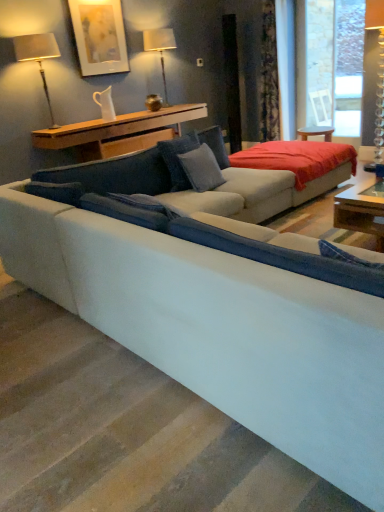
In order to face blue fabric pillow at center, positioned as the first pillow in right-to-left order, should I rotate leftwards or rightwards?

A 1.529 degree turn to the right will do.

What do you see at coordinates (99, 36) in the screenshot? I see `matte white picture frame at upper left` at bounding box center [99, 36].

Image resolution: width=384 pixels, height=512 pixels. In order to click on wooden shelf at upper center in this screenshot , I will do `click(119, 132)`.

What do you see at coordinates (178, 159) in the screenshot? I see `suede-like blue pillow at center, which is the second pillow in right-to-left order` at bounding box center [178, 159].

Locate an element on the screen. matte silver table lamp at upper left, which ranks as the 1th table lamp in left-to-right order is located at coordinates (38, 57).

How much space does matte silver table lamp at upper left, which ranks as the 1th table lamp in left-to-right order, occupy horizontally?

matte silver table lamp at upper left, which ranks as the 1th table lamp in left-to-right order, is 9.94 inches wide.

The height and width of the screenshot is (512, 384). Find the location of `blue fabric pillow at center, positioned as the first pillow in right-to-left order`. blue fabric pillow at center, positioned as the first pillow in right-to-left order is located at coordinates (201, 168).

Visually, is blue fabric pillow at center, placed as the 2th pillow when sorted from left to right, positioned to the left or to the right of matte white lampshade at upper center, which is counted as the first table lamp, starting from the back?

In the image, blue fabric pillow at center, placed as the 2th pillow when sorted from left to right, appears on the right side of matte white lampshade at upper center, which is counted as the first table lamp, starting from the back.

Is blue fabric pillow at center, placed as the 2th pillow when sorted from left to right, located outside matte white lampshade at upper center, positioned as the 1th table lamp in right-to-left order?

Yes.

Consider the image. Can you tell me how much blue fabric pillow at center, positioned as the first pillow in right-to-left order, and matte white lampshade at upper center, positioned as the 1th table lamp in right-to-left order, differ in facing direction?

blue fabric pillow at center, positioned as the first pillow in right-to-left order, and matte white lampshade at upper center, positioned as the 1th table lamp in right-to-left order, are facing 9.56 degrees away from each other.

From the image's perspective, is blue fabric pillow at center, positioned as the first pillow in right-to-left order, positioned above or below matte white picture frame at upper left?

From the image's perspective, blue fabric pillow at center, positioned as the first pillow in right-to-left order, appears below matte white picture frame at upper left.

Is blue fabric pillow at center, positioned as the first pillow in right-to-left order, far away from matte white picture frame at upper left?

Indeed, blue fabric pillow at center, positioned as the first pillow in right-to-left order, is not near matte white picture frame at upper left.

Is matte white picture frame at upper left a part of blue fabric pillow at center, positioned as the first pillow in right-to-left order?

Actually, matte white picture frame at upper left is outside blue fabric pillow at center, positioned as the first pillow in right-to-left order.

Is blue fabric pillow at center, placed as the 2th pillow when sorted from left to right, looking in the opposite direction of matte white picture frame at upper left?

blue fabric pillow at center, placed as the 2th pillow when sorted from left to right, is not turned away from matte white picture frame at upper left.

Between suede-like blue pillow at center, which is the second pillow in right-to-left order, and matte white lampshade at upper center, the second table lamp viewed from the left, which one has less height?

With less height is suede-like blue pillow at center, which is the second pillow in right-to-left order.

Does suede-like blue pillow at center, which is the second pillow in right-to-left order, turn towards matte white lampshade at upper center, the second table lamp viewed from the left?

No, suede-like blue pillow at center, which is the second pillow in right-to-left order, is not facing towards matte white lampshade at upper center, the second table lamp viewed from the left.

Identify the location of the 1st table lamp to the left of the suede-like blue pillow at center, which is the second pillow in right-to-left order, counting from the anchor's position. The height and width of the screenshot is (512, 384). click(x=160, y=49).

From the picture: In the image, is suede-like blue pillow at center, which is the second pillow in right-to-left order, positioned in front of or behind matte white lampshade at upper center, which is counted as the first table lamp, starting from the back?

suede-like blue pillow at center, which is the second pillow in right-to-left order, is in front of matte white lampshade at upper center, which is counted as the first table lamp, starting from the back.

Considering the relative sizes of blue fabric pillow at center, positioned as the first pillow in right-to-left order, and wooden shelf at upper center in the image provided, is blue fabric pillow at center, positioned as the first pillow in right-to-left order, smaller than wooden shelf at upper center?

Yes, blue fabric pillow at center, positioned as the first pillow in right-to-left order, is smaller than wooden shelf at upper center.

Looking at this image, is blue fabric pillow at center, placed as the 2th pillow when sorted from left to right, looking in the opposite direction of wooden shelf at upper center?

Correct, blue fabric pillow at center, placed as the 2th pillow when sorted from left to right, is looking away from wooden shelf at upper center.

Is blue fabric pillow at center, positioned as the first pillow in right-to-left order, outside of wooden shelf at upper center?

Yes, blue fabric pillow at center, positioned as the first pillow in right-to-left order, is outside of wooden shelf at upper center.

In the scene shown: Can you confirm if blue fabric pillow at center, placed as the 2th pillow when sorted from left to right, is wider than wooden shelf at upper center?

Incorrect, the width of blue fabric pillow at center, placed as the 2th pillow when sorted from left to right, does not surpass that of wooden shelf at upper center.

Does matte white picture frame at upper left have a lesser height compared to suede-like blue pillow at center, which is the second pillow in right-to-left order?

No, matte white picture frame at upper left is not shorter than suede-like blue pillow at center, which is the second pillow in right-to-left order.

Is matte white picture frame at upper left oriented towards suede-like blue pillow at center, which is the second pillow in right-to-left order?

No, matte white picture frame at upper left is not facing towards suede-like blue pillow at center, which is the second pillow in right-to-left order.

Is matte white picture frame at upper left closer to camera compared to suede-like blue pillow at center, which is the second pillow in right-to-left order?

No, it is behind suede-like blue pillow at center, which is the second pillow in right-to-left order.

From a real-world perspective, is matte white picture frame at upper left below suede-like blue pillow at center, which is the second pillow in right-to-left order?

No, from a real-world perspective, matte white picture frame at upper left is not below suede-like blue pillow at center, which is the second pillow in right-to-left order.

From the image's perspective, is wooden shelf at upper center on top of matte white picture frame at upper left?

No, from the image's perspective, wooden shelf at upper center is not on top of matte white picture frame at upper left.

Considering the points (122, 123) and (123, 32), which point is behind, point (122, 123) or point (123, 32)?

The point (123, 32) is more distant.

Measure the distance from wooden shelf at upper center to matte white picture frame at upper left.

wooden shelf at upper center and matte white picture frame at upper left are 31.52 inches apart from each other.

Is wooden shelf at upper center not close to matte white picture frame at upper left?

No, there isn't a large distance between wooden shelf at upper center and matte white picture frame at upper left.

Where is `pillow behind the blue fabric pillow at center, positioned as the first pillow in right-to-left order`? Image resolution: width=384 pixels, height=512 pixels. pillow behind the blue fabric pillow at center, positioned as the first pillow in right-to-left order is located at coordinates (178, 159).

From the picture: From the image's perspective, is suede-like blue pillow at center, which is the second pillow in right-to-left order, located above or below blue fabric pillow at center, placed as the 2th pillow when sorted from left to right?

Based on their image positions, suede-like blue pillow at center, which is the second pillow in right-to-left order, is located above blue fabric pillow at center, placed as the 2th pillow when sorted from left to right.

How different are the orientations of suede-like blue pillow at center, which is the second pillow in right-to-left order, and blue fabric pillow at center, placed as the 2th pillow when sorted from left to right, in degrees?

7.65 degrees separate the facing orientations of suede-like blue pillow at center, which is the second pillow in right-to-left order, and blue fabric pillow at center, placed as the 2th pillow when sorted from left to right.

Between suede-like blue pillow at center, the first pillow from the left, and blue fabric pillow at center, placed as the 2th pillow when sorted from left to right, which one is positioned behind?

suede-like blue pillow at center, the first pillow from the left, is behind.

From the image's perspective, which table lamp is the 2nd one above the blue fabric pillow at center, placed as the 2th pillow when sorted from left to right? Please provide its 2D coordinates.

[(160, 49)]

Which pillow is the 2nd one when counting from the front of the matte white picture frame at upper left? Please provide its 2D coordinates.

[(201, 168)]

Based on their spatial positions, is matte white picture frame at upper left or blue fabric pillow at center, placed as the 2th pillow when sorted from left to right, closer to matte silver table lamp at upper left, the second table lamp when ordered from back to front?

Based on the image, matte white picture frame at upper left appears to be nearer to matte silver table lamp at upper left, the second table lamp when ordered from back to front.

Estimate the real-world distances between objects in this image. Which object is closer to matte white lampshade at upper center, positioned as the 1th table lamp in right-to-left order, matte white picture frame at upper left or suede-like blue pillow at center, the first pillow from the left?

matte white picture frame at upper left lies closer to matte white lampshade at upper center, positioned as the 1th table lamp in right-to-left order, than the other object.

From the image, which object appears to be nearer to matte white picture frame at upper left, matte white lampshade at upper center, the second table lamp viewed from the left, or matte silver table lamp at upper left, which ranks as the 1th table lamp in left-to-right order?

A: matte silver table lamp at upper left, which ranks as the 1th table lamp in left-to-right order.

Estimate the real-world distances between objects in this image. Which object is closer to wooden shelf at upper center, blue fabric pillow at center, placed as the 2th pillow when sorted from left to right, or matte white lampshade at upper center, placed as the 2th table lamp when sorted from front to back?

matte white lampshade at upper center, placed as the 2th table lamp when sorted from front to back, is positioned closer to the anchor wooden shelf at upper center.

Based on their spatial positions, is matte silver table lamp at upper left, the 2th table lamp positioned from the right, or matte white lampshade at upper center, placed as the 2th table lamp when sorted from front to back, further from matte white picture frame at upper left?

matte white lampshade at upper center, placed as the 2th table lamp when sorted from front to back.

Consider the image. Considering their positions, is suede-like blue pillow at center, the first pillow from the left, positioned closer to matte white lampshade at upper center, placed as the 2th table lamp when sorted from front to back, than wooden shelf at upper center?

wooden shelf at upper center lies closer to matte white lampshade at upper center, placed as the 2th table lamp when sorted from front to back, than the other object.

Based on their spatial positions, is matte silver table lamp at upper left, the second table lamp when ordered from back to front, or wooden shelf at upper center closer to matte white lampshade at upper center, placed as the 2th table lamp when sorted from front to back?

The object closer to matte white lampshade at upper center, placed as the 2th table lamp when sorted from front to back, is wooden shelf at upper center.

From the image, which object appears to be nearer to matte silver table lamp at upper left, which ranks as the 1th table lamp in left-to-right order, blue fabric pillow at center, positioned as the first pillow in right-to-left order, or matte white picture frame at upper left?

The object closer to matte silver table lamp at upper left, which ranks as the 1th table lamp in left-to-right order, is matte white picture frame at upper left.

At what (x,y) coordinates should I click in order to perform the action: click on picture frame between matte silver table lamp at upper left, which ranks as the 1th table lamp in left-to-right order, and matte white lampshade at upper center, which is counted as the first table lamp, starting from the back. Please return your answer as a coordinate pair (x, y). Looking at the image, I should click on (99, 36).

I want to click on table between matte white picture frame at upper left and suede-like blue pillow at center, which is the second pillow in right-to-left order, in the vertical direction, so click(119, 132).

In order to click on table lamp located between suede-like blue pillow at center, the first pillow from the left, and matte white lampshade at upper center, the second table lamp viewed from the left, in the depth direction in this screenshot , I will do `click(38, 57)`.

This screenshot has height=512, width=384. Find the location of `pillow between matte silver table lamp at upper left, which ranks as the 1th table lamp in left-to-right order, and blue fabric pillow at center, positioned as the first pillow in right-to-left order`. pillow between matte silver table lamp at upper left, which ranks as the 1th table lamp in left-to-right order, and blue fabric pillow at center, positioned as the first pillow in right-to-left order is located at coordinates [178, 159].